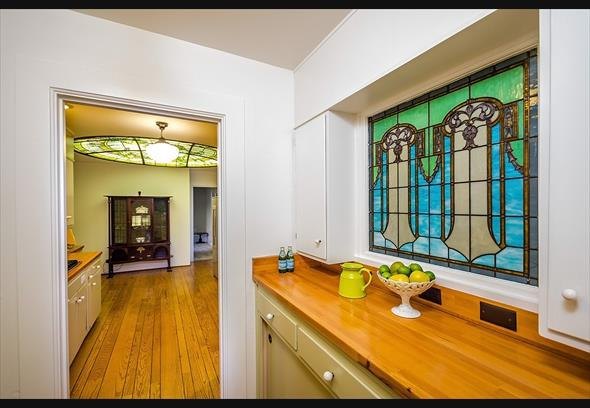
The width and height of the screenshot is (590, 408). I want to click on handle, so click(x=310, y=359).